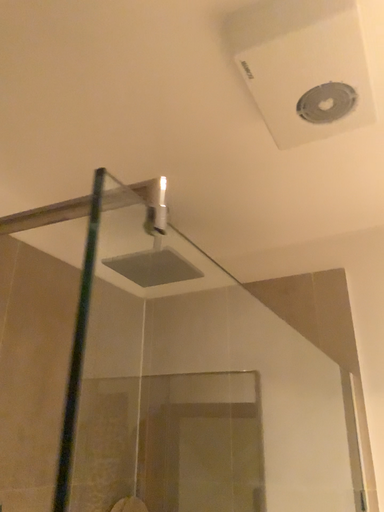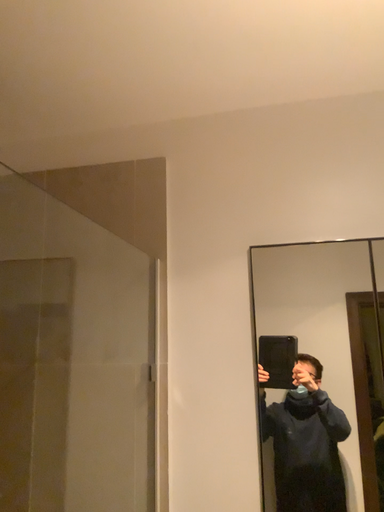
Question: Which way did the camera rotate in the video?

Choices:
 (A) rotated right
 (B) rotated left

Answer: (A)